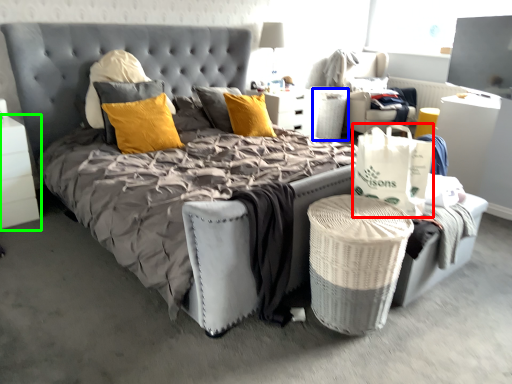
Question: Based on their relative distances, which object is farther from shopping bag (highlighted by a red box)? Choose from basket (highlighted by a blue box) and nightstand (highlighted by a green box).

Choices:
 (A) basket
 (B) nightstand

Answer: (A)